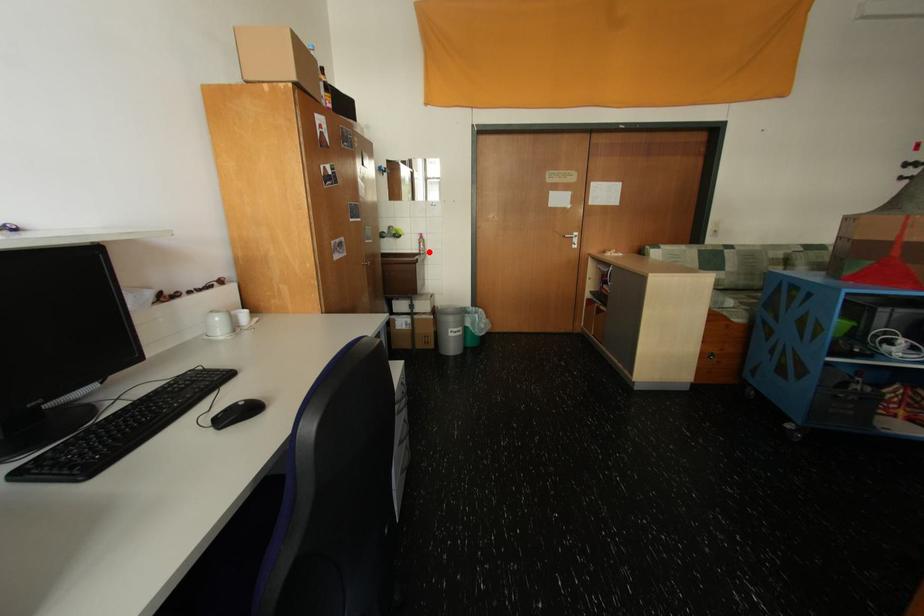
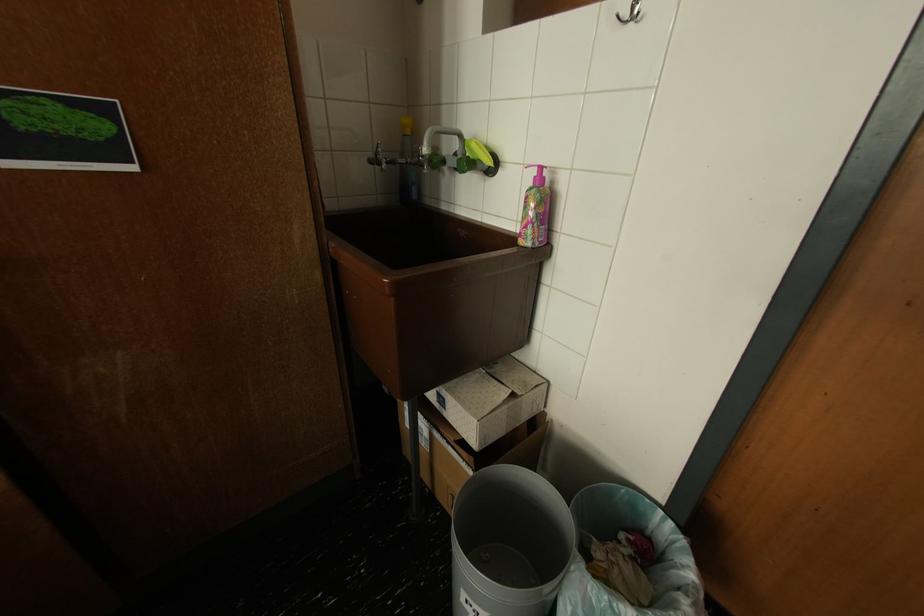
Locate, in the second image, the point that corresponds to the highlighted location in the first image.

(529, 235)